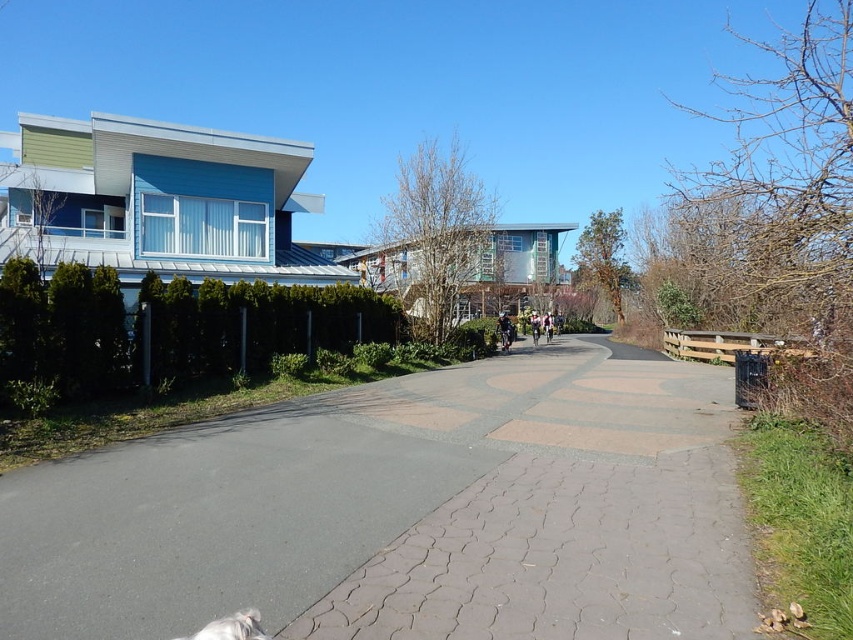
You are a photographer standing at the end of the paved pathway. You want to take a photo that includes both the white fur dog at lower left and the light blue fabric jacket at center. Which object should you focus on first if you want to ensure both are in the frame?

The white fur dog at lower left is not as tall as the light blue fabric jacket at center, so you should focus on the light blue fabric jacket at center first to ensure both are in the frame.

You are standing at the camera position looking at the suburban scene. A drone is flying towards the point marked at coordinates point (263, 637). If the drone needs to stay at least 5 feet away from any people in the image, is the drone safe to fly there?

The distance of point (263, 637) from camera is 6.24 feet. Since the drone needs to stay at least 5 feet away from any people, and the point is 6.24 feet away, the drone is safe to fly there as it meets the distance requirement.

You are a photographer standing at the end of the paved pathway. You want to capture both the white fur dog at lower left and the white fabric jacket at center in a single frame. Based on their sizes in the scene, which object should you focus on first to ensure both are in the frame?

Since the white fur dog at lower left occupies less space than the white fabric jacket at center, you should focus on the white fabric jacket at center first to ensure both are in the frame.